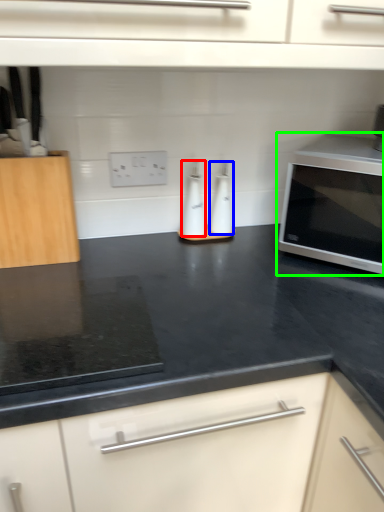
Question: Which object is the closest to the bottle (highlighted by a red box)? Choose among these: bottle (highlighted by a blue box) or microwave oven (highlighted by a green box).

Choices:
 (A) bottle
 (B) microwave oven

Answer: (A)